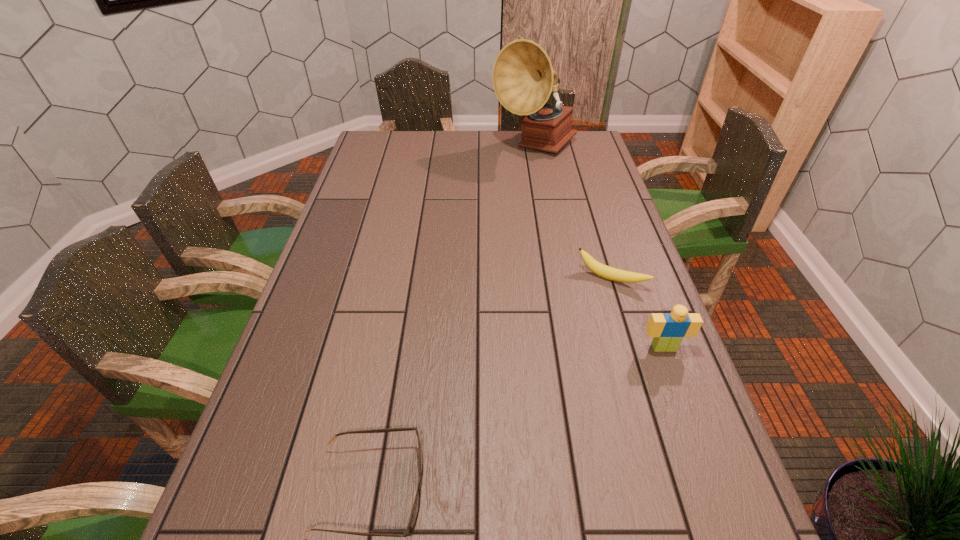
The width and height of the screenshot is (960, 540). What are the coordinates of `free spot that satisfies the following two spatial constraints: 1. on the front side of the farthest object; 2. on the right side of the third tallest object` in the screenshot? It's located at [559, 279].

Find the location of a particular element. The height and width of the screenshot is (540, 960). free space that satisfies the following two spatial constraints: 1. on the front side of the farthest object; 2. on the right side of the third tallest object is located at coordinates (559, 279).